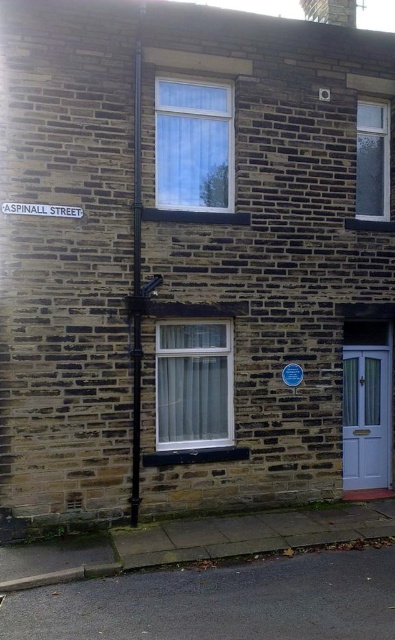
You are standing 20 feet away from the two story brick building. You want to reach the point at coordinate point (x=351, y=436). Is the point closer to you or farther than your current position?

The point at coordinate point (x=351, y=436) is 25.62 feet away from the viewer. Since you are currently 20 feet away from the building, the point is farther than your current position.

In the scene shown: You are a delivery person arriving at the building. You need to enter through the white glossy door at lower right. Is the metallic pole at center blocking your path to the door?

The metallic pole at center is behind the white glossy door at lower right, so it is not blocking the path to the door.

You are a delivery person trying to find the entrance to the building. You see the white glossy door at lower right and the white plastic street sign at upper left. Which one is bigger?

The white glossy door at lower right is larger than the white plastic street sign at upper left.